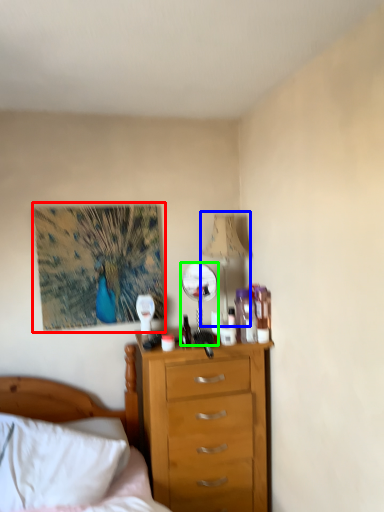
Question: Which is farther away from picture frame (highlighted by a red box)? lamp (highlighted by a blue box) or mirror (highlighted by a green box)?

Choices:
 (A) lamp
 (B) mirror

Answer: (A)